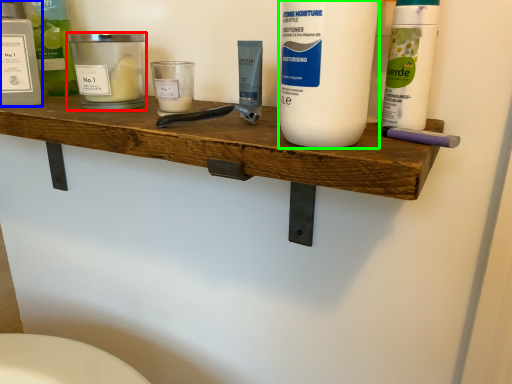
Question: Which object is positioned farthest from personal care (highlighted by a red box)? Select from personal care (highlighted by a blue box) and cleaning product (highlighted by a green box).

Choices:
 (A) personal care
 (B) cleaning product

Answer: (B)